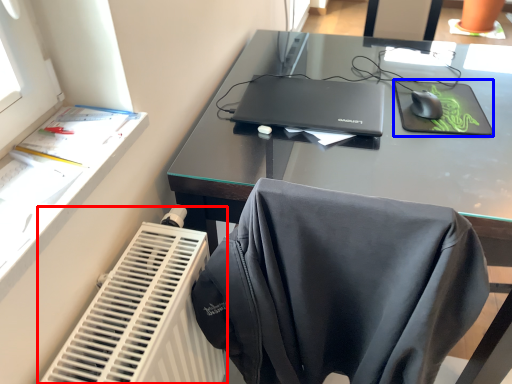
Question: Which point is further to the camera, radiator (highlighted by a red box) or mousepad (highlighted by a blue box)?

Choices:
 (A) radiator
 (B) mousepad

Answer: (B)